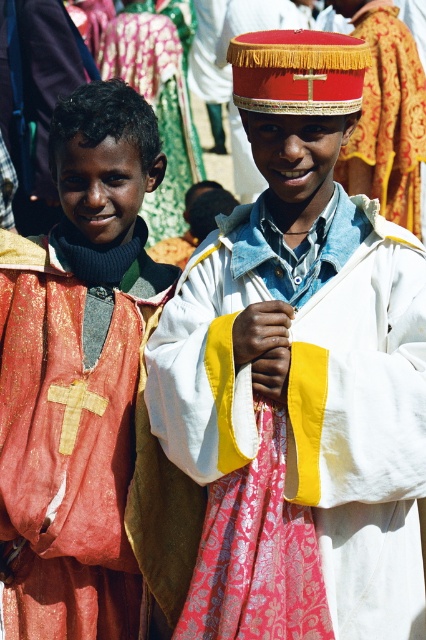
Question: Can you confirm if white/yellow fabric vest at center is thinner than shiny red vest at left?

Choices:
 (A) yes
 (B) no

Answer: (B)

Question: Is white/yellow fabric vest at center positioned before shiny red vest at left?

Choices:
 (A) no
 (B) yes

Answer: (B)

Question: Which point is farther to the camera?

Choices:
 (A) white/yellow fabric vest at center
 (B) shiny red vest at left

Answer: (B)

Question: Which point appears farthest from the camera in this image?

Choices:
 (A) (14, 465)
 (B) (356, 400)

Answer: (A)

Question: Does white/yellow fabric vest at center appear on the left side of shiny red vest at left?

Choices:
 (A) no
 (B) yes

Answer: (A)